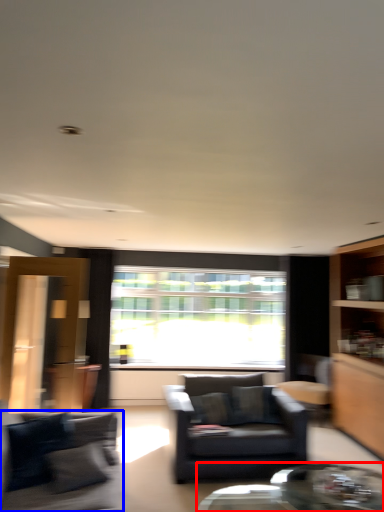
Question: Which object is further to the camera taking this photo, coffee table (highlighted by a red box) or studio couch (highlighted by a blue box)?

Choices:
 (A) coffee table
 (B) studio couch

Answer: (A)